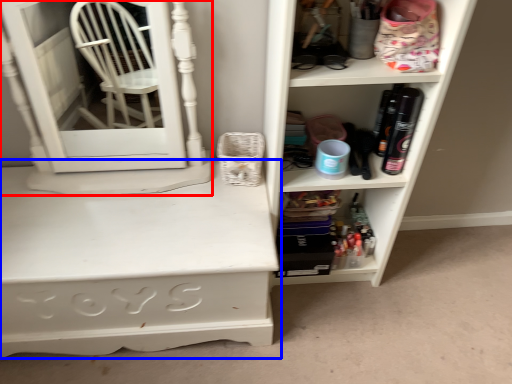
Question: Which object appears farthest to the camera in this image, medicine cabinet (highlighted by a red box) or desk (highlighted by a blue box)?

Choices:
 (A) medicine cabinet
 (B) desk

Answer: (B)